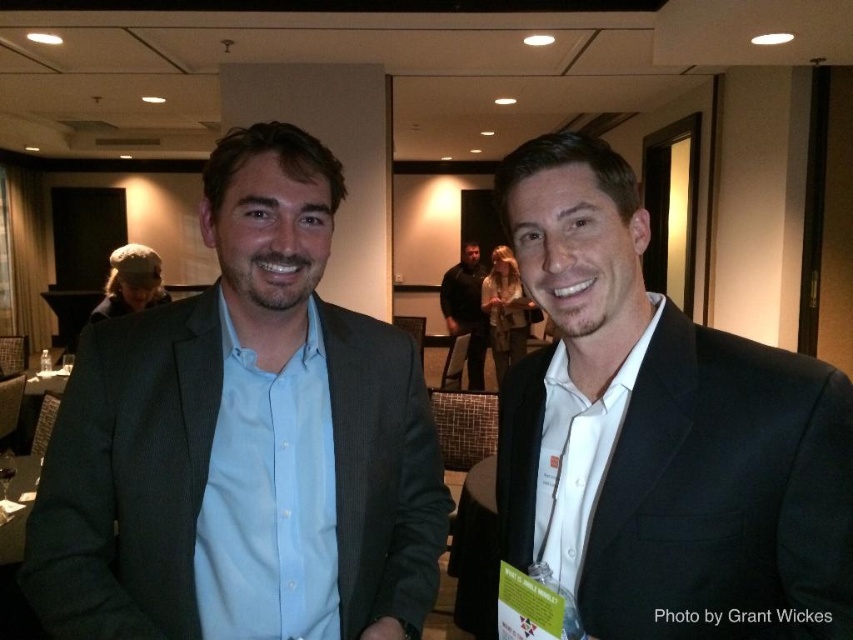
Question: Which object appears closest to the camera in this image?

Choices:
 (A) dark brown leather jacket at center
 (B) matte black suit at left

Answer: (B)

Question: Does matte black suit at left have a lesser width compared to dark brown leather jacket at center?

Choices:
 (A) yes
 (B) no

Answer: (B)

Question: Does matte black suit at left appear on the right side of dark brown leather jacket at center?

Choices:
 (A) no
 (B) yes

Answer: (A)

Question: Can you confirm if matte black suit at left is smaller than dark brown leather jacket at center?

Choices:
 (A) no
 (B) yes

Answer: (A)

Question: Which point appears closest to the camera in this image?

Choices:
 (A) (268, 122)
 (B) (469, 321)
 (C) (799, 376)

Answer: (C)

Question: Considering the real-world distances, which object is farthest from the matte black suit at right?

Choices:
 (A) dark brown leather jacket at center
 (B) matte black suit at left

Answer: (A)